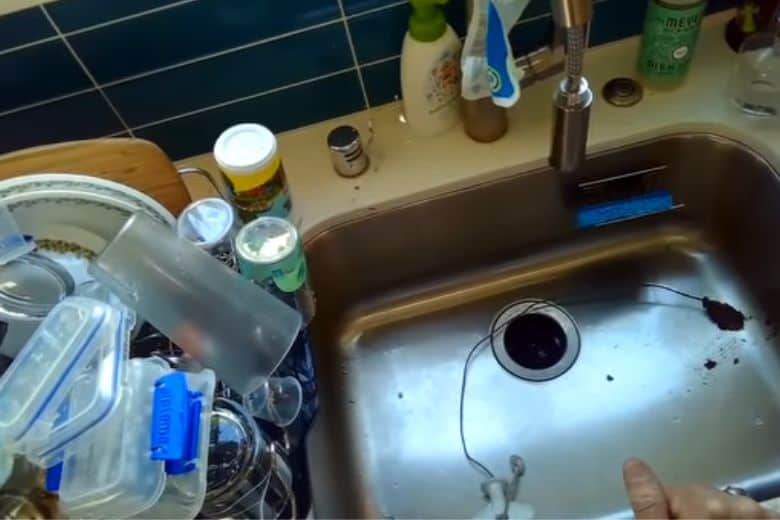
Locate an element on the screen. cup is located at coordinates (240, 159).